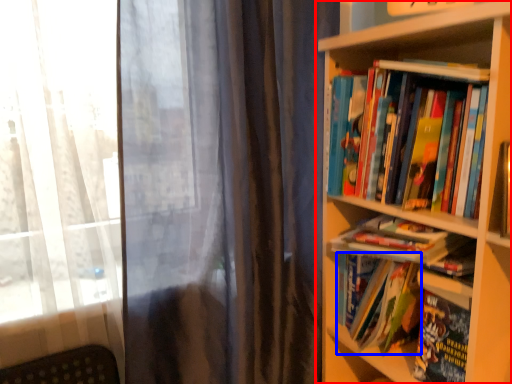
Question: Which of the following is the farthest to the observer, bookcase (highlighted by a red box) or book (highlighted by a blue box)?

Choices:
 (A) bookcase
 (B) book

Answer: (B)